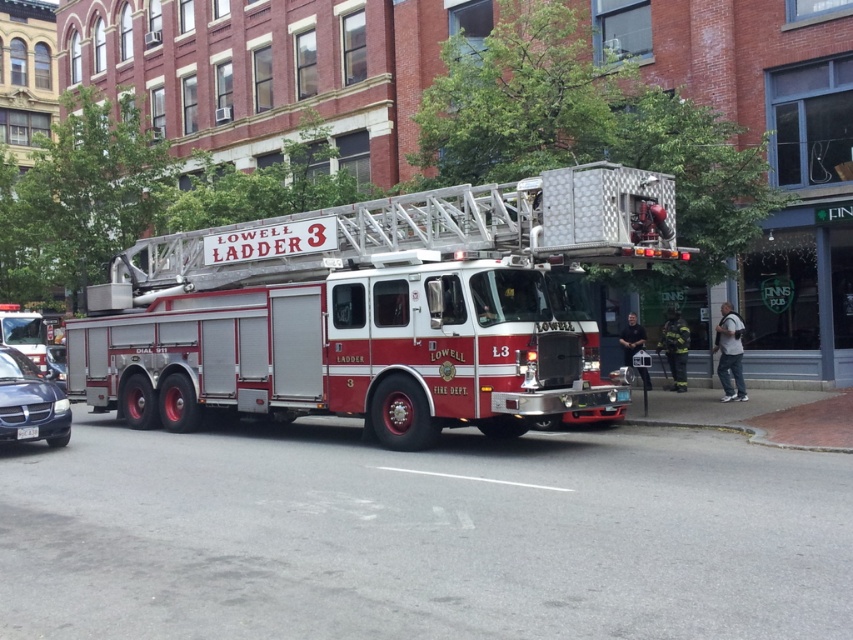
Question: Considering the real-world distances, which object is closest to the metallic silver fire truck at left?

Choices:
 (A) metallic blue sedan at lower left
 (B) red metallic fire truck at center
 (C) white plastic license plate at center

Answer: (A)

Question: Does metallic blue sedan at lower left have a lesser width compared to metallic silver fire truck at left?

Choices:
 (A) no
 (B) yes

Answer: (B)

Question: Which of the following is the closest to the observer?

Choices:
 (A) metallic silver fire truck at left
 (B) red metallic fire truck at center

Answer: (B)

Question: Which object is closer to the camera taking this photo?

Choices:
 (A) metallic blue sedan at lower left
 (B) metallic silver fire truck at left

Answer: (A)

Question: Considering the relative positions of red metallic fire truck at center and metallic silver fire truck at left in the image provided, where is red metallic fire truck at center located with respect to metallic silver fire truck at left?

Choices:
 (A) left
 (B) right

Answer: (B)

Question: In this image, where is red metallic fire truck at center located relative to white plastic license plate at center?

Choices:
 (A) left
 (B) right

Answer: (B)